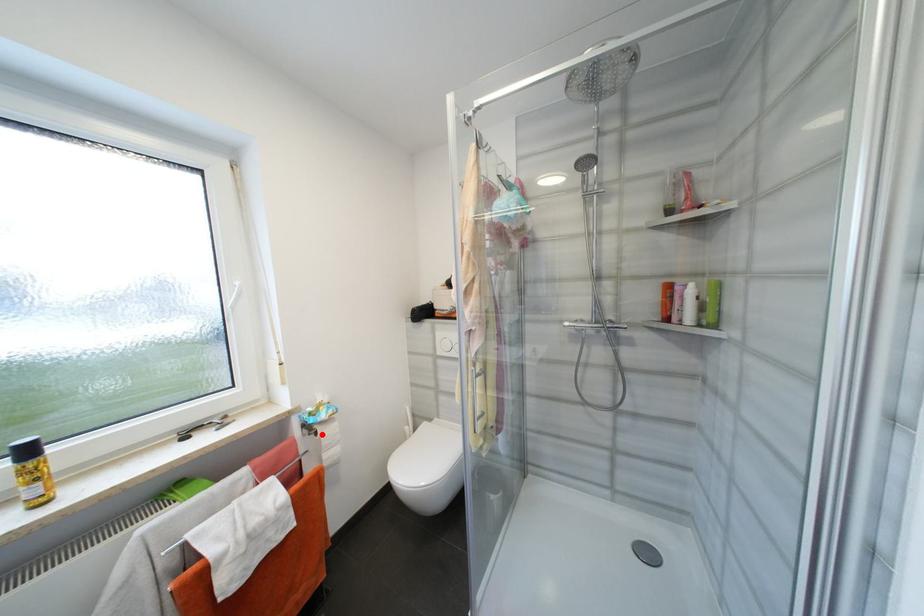
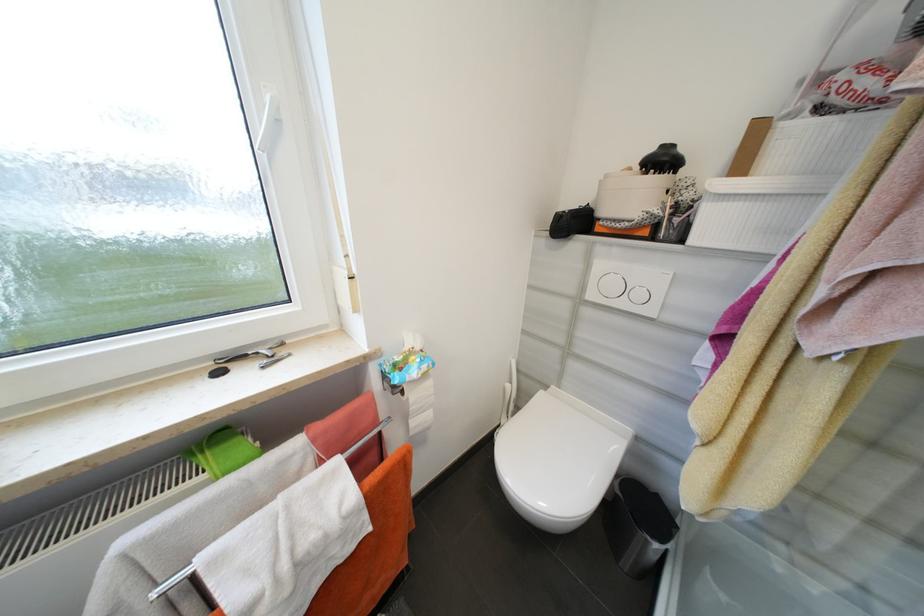
Question: I am providing you with two images of the same scene from different viewpoints. A red point is marked on the first image. At the location where the point appears in image 1, is it still visible in image 2?

Choices:
 (A) Yes
 (B) No

Answer: (A)